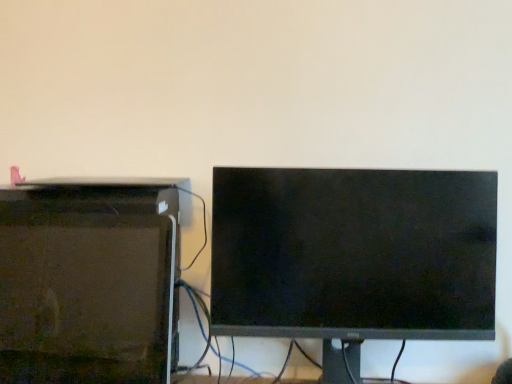
Question: In the image, is matte black desktop computer at left positioned in front of or behind black matte monitor at center?

Choices:
 (A) behind
 (B) front

Answer: (B)

Question: Would you say matte black desktop computer at left is to the left or to the right of black matte monitor at center in the picture?

Choices:
 (A) left
 (B) right

Answer: (A)

Question: From the image's perspective, is matte black desktop computer at left positioned above or below black matte monitor at center?

Choices:
 (A) below
 (B) above

Answer: (A)

Question: Visually, is black matte monitor at center positioned to the left or to the right of matte black desktop computer at left?

Choices:
 (A) left
 (B) right

Answer: (B)

Question: From the image's perspective, is black matte monitor at center above or below matte black desktop computer at left?

Choices:
 (A) below
 (B) above

Answer: (B)

Question: Considering their positions, is black matte monitor at center located in front of or behind matte black desktop computer at left?

Choices:
 (A) behind
 (B) front

Answer: (A)

Question: From a real-world perspective, is black matte monitor at center positioned above or below matte black desktop computer at left?

Choices:
 (A) above
 (B) below

Answer: (A)